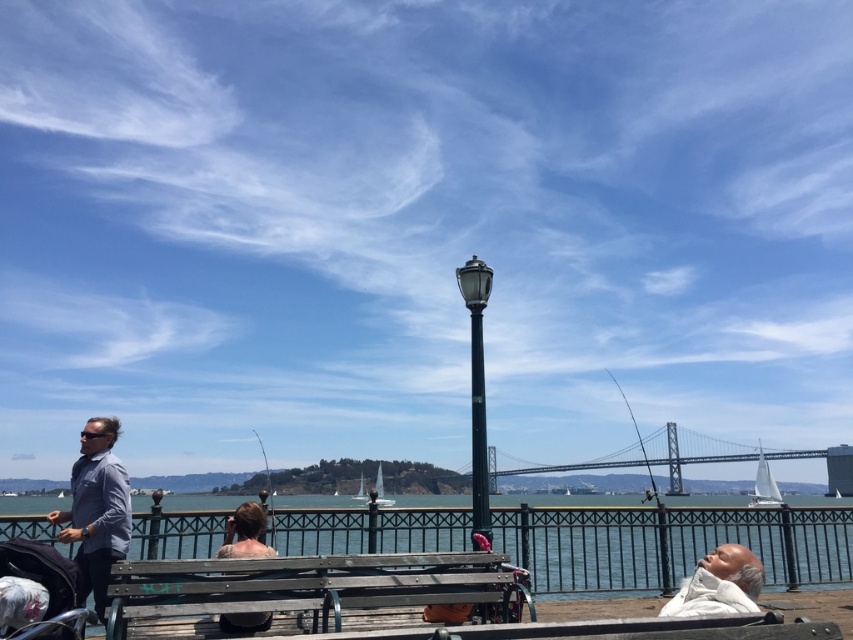
Is point (109, 627) farther from viewer compared to point (61, 589)?

No, (109, 627) is closer to viewer.

Is wooden bench at center bigger than white fabric baby carriage at lower left?

Yes, wooden bench at center is bigger than white fabric baby carriage at lower left.

Describe the element at coordinates (311, 593) in the screenshot. I see `wooden bench at center` at that location.

The width and height of the screenshot is (853, 640). Find the location of `wooden bench at center`. wooden bench at center is located at coordinates (311, 593).

Is metallic gray bridge at center positioned before white fabric baby carriage at lower left?

No, it is not.

Who is lower down, metallic gray bridge at center or white fabric baby carriage at lower left?

metallic gray bridge at center

The image size is (853, 640). Identify the location of metallic gray bridge at center. (691, 451).

Identify the location of metallic gray bridge at center. The image size is (853, 640). (691, 451).

Who is taller, white fabric baby carriage at lower left or brown hair at center?

With more height is brown hair at center.

Which is below, white fabric baby carriage at lower left or brown hair at center?

brown hair at center is lower down.

Is point (65, 598) less distant than point (258, 532)?

Yes, point (65, 598) is closer to viewer.

Locate an element on the screen. white fabric baby carriage at lower left is located at coordinates (44, 570).